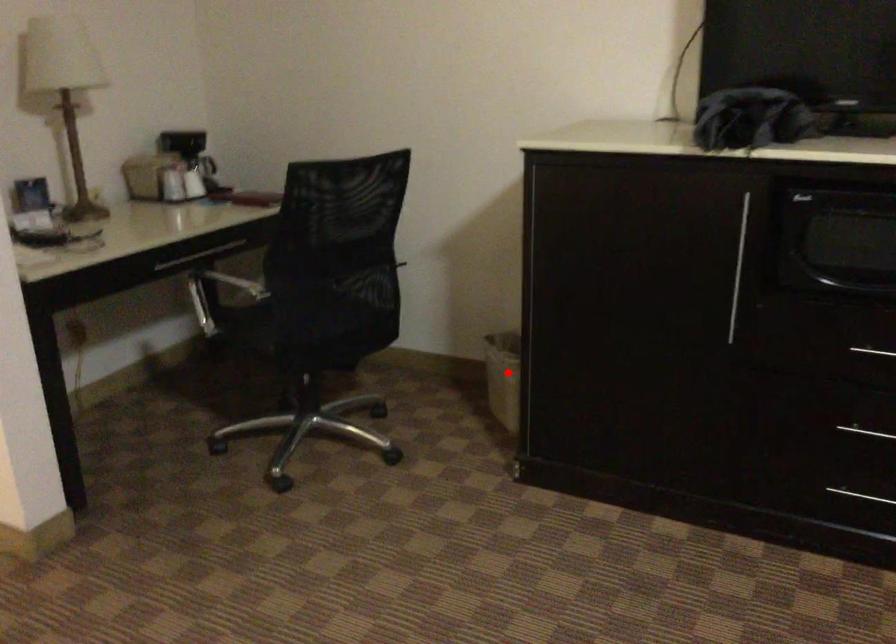
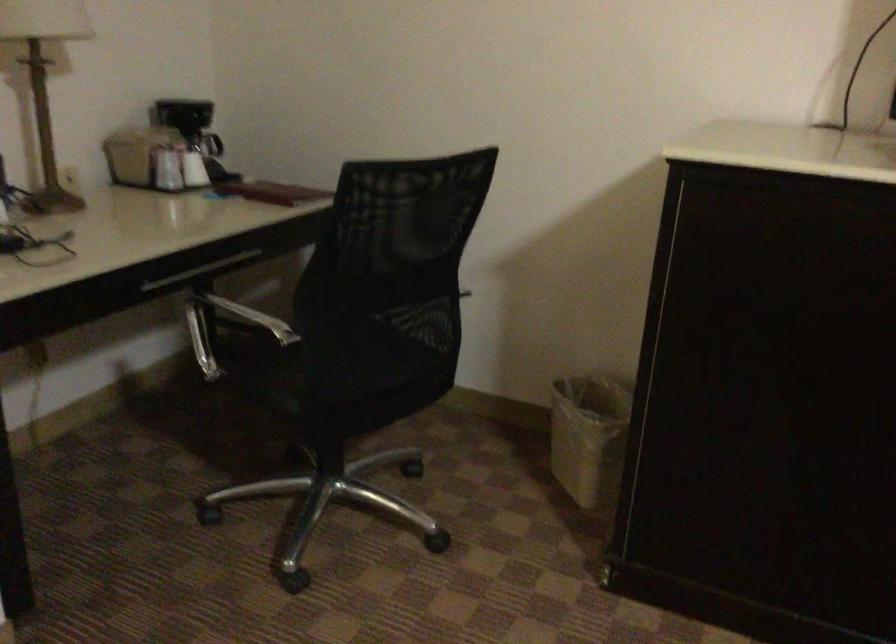
Question: I am providing you with two images of the same scene from different viewpoints. A red point is shown in image1. For the corresponding object point in image2, is it positioned nearer or farther from the camera?

Choices:
 (A) Nearer
 (B) Farther

Answer: (A)